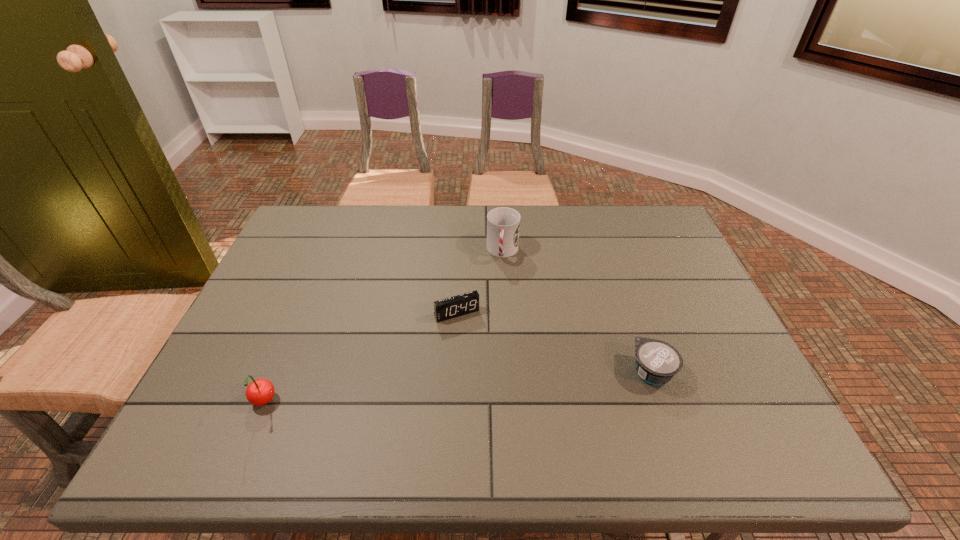
You are a GUI agent. You are given a task and a screenshot of the screen. Output one action in this format:
    pyautogui.click(x=<x>, y=<y>)
    Task: Click on the vacant spot on the desktop that is between the leftmost object and the yogurt and is positioned on the handle side of the third object from left to right
    The width and height of the screenshot is (960, 540).
    Given the screenshot: What is the action you would take?
    pyautogui.click(x=487, y=384)

You are a GUI agent. You are given a task and a screenshot of the screen. Output one action in this format:
    pyautogui.click(x=<x>, y=<y>)
    Task: Click on the free spot on the desktop that is between the cherry and the yogurt and is positioned on the front-facing side of the third nearest object
    The width and height of the screenshot is (960, 540).
    Given the screenshot: What is the action you would take?
    pyautogui.click(x=492, y=384)